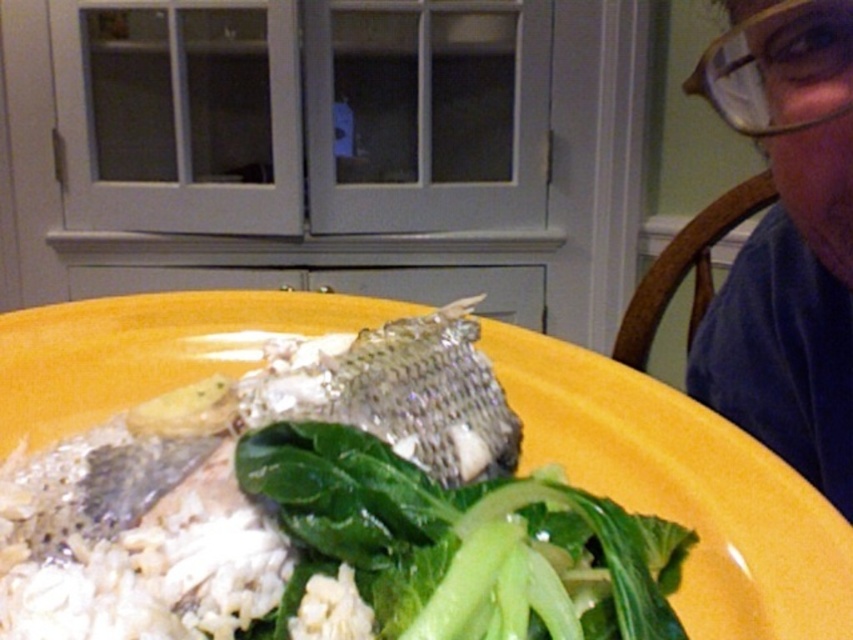
Between point (12, 342) and point (636, 620), which one is positioned in front?

Point (636, 620) is more forward.

Is shiny silver fish at center to the left of green leafy at center from the viewer's perspective?

Yes, shiny silver fish at center is to the left of green leafy at center.

This screenshot has height=640, width=853. I want to click on shiny silver fish at center, so click(686, 490).

Identify the location of shiny silver fish at center. The width and height of the screenshot is (853, 640). (686, 490).

Is green leafy at center to the right of matte blue shirt at upper right from the viewer's perspective?

No, green leafy at center is not to the right of matte blue shirt at upper right.

Between green leafy at center and matte blue shirt at upper right, which one appears on the left side from the viewer's perspective?

Positioned to the left is green leafy at center.

Is point (619, 545) less distant than point (811, 369)?

Yes, it is.

In order to click on green leafy at center in this screenshot , I will do `click(461, 544)`.

Where is `shiny silver fish at center`? shiny silver fish at center is located at coordinates (686, 490).

Between shiny silver fish at center and matte blue shirt at upper right, which one is positioned lower?

shiny silver fish at center is below.

Between point (822, 554) and point (761, 92), which one is positioned in front?

Point (822, 554) is in front.

Locate an element on the screen. shiny silver fish at center is located at coordinates (686, 490).